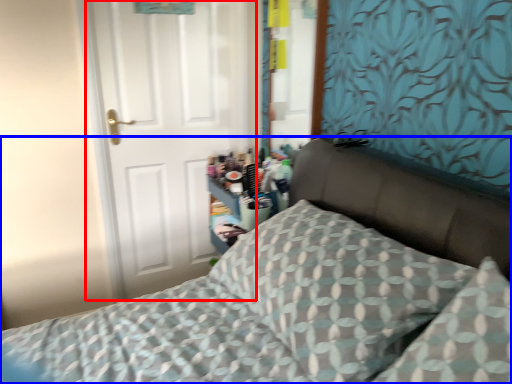
Question: Which object appears farthest to the camera in this image, door (highlighted by a red box) or bed (highlighted by a blue box)?

Choices:
 (A) door
 (B) bed

Answer: (A)